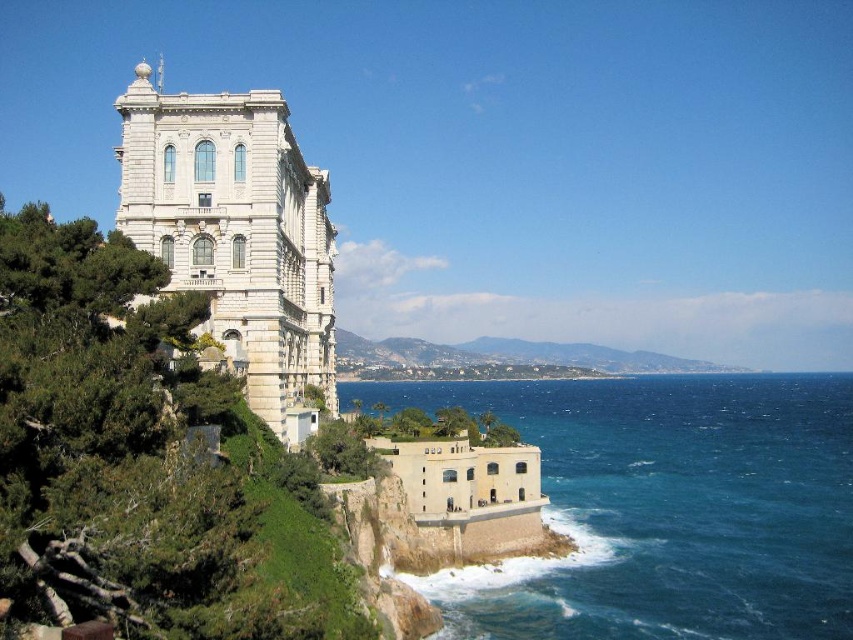
You are standing on a cliff overlooking the ocean and see the blue water at lower right and the white stone building at upper left. Which object appears taller from your vantage point?

The white stone building at upper left appears taller than the blue water at lower right.

You are standing on the cliff and looking at the blue water at lower right and the white stone building at upper left. Which object is closer to you?

The blue water at lower right is closer to you because it is further to the viewer than the white stone building at upper left.

You are a drone operator tasked with capturing aerial footage of the historic building. The drone is currently positioned at the center of the image. To avoid obstacles, you need to adjust the drone to the left or right. Based on the location of the blue water at lower right, which direction should you move the drone to ensure it stays clear of the water?

The blue water at lower right is located at coordinates point (665, 508). Since the drone is at the center, moving it to the left would keep it away from the water positioned at the lower right corner.